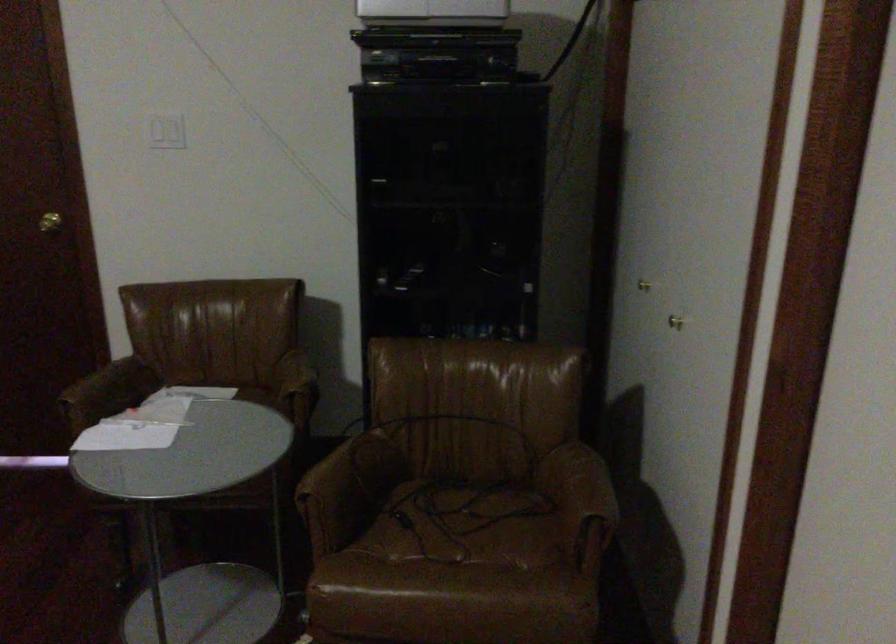
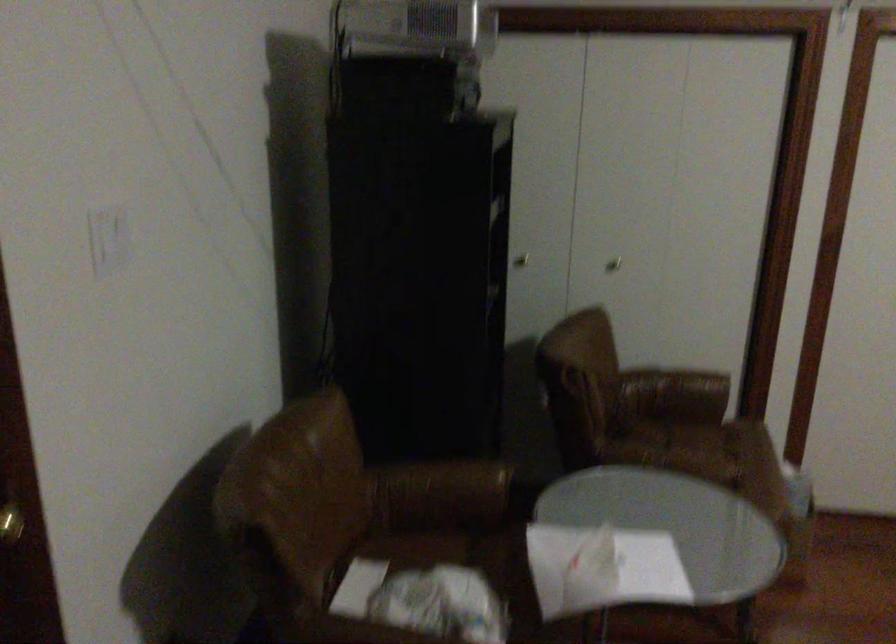
In the second image, find the point that corresponds to (x=286, y=381) in the first image.

(442, 488)